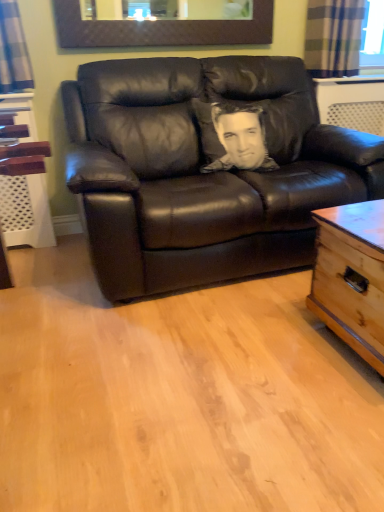
Question: Is plaid fabric curtain at upper right taller than light brown wooden trunk at right?

Choices:
 (A) yes
 (B) no

Answer: (B)

Question: Is plaid fabric curtain at upper right at the left side of light brown wooden trunk at right?

Choices:
 (A) no
 (B) yes

Answer: (A)

Question: From the image's perspective, is plaid fabric curtain at upper right beneath light brown wooden trunk at right?

Choices:
 (A) yes
 (B) no

Answer: (B)

Question: Is plaid fabric curtain at upper right oriented away from light brown wooden trunk at right?

Choices:
 (A) no
 (B) yes

Answer: (A)

Question: Is plaid fabric curtain at upper right at the right side of light brown wooden trunk at right?

Choices:
 (A) no
 (B) yes

Answer: (B)

Question: Do you think plaid fabric curtain at upper right is within matte brown picture frame at upper center, or outside of it?

Choices:
 (A) inside
 (B) outside

Answer: (B)

Question: Considering the positions of plaid fabric curtain at upper right and matte brown picture frame at upper center in the image, is plaid fabric curtain at upper right taller or shorter than matte brown picture frame at upper center?

Choices:
 (A) short
 (B) tall

Answer: (B)

Question: Visually, is plaid fabric curtain at upper right positioned to the left or to the right of matte brown picture frame at upper center?

Choices:
 (A) left
 (B) right

Answer: (B)

Question: From the image's perspective, is plaid fabric curtain at upper right positioned above or below matte brown picture frame at upper center?

Choices:
 (A) below
 (B) above

Answer: (B)

Question: From their relative heights in the image, would you say matte black leather couch at center is taller or shorter than sepia-toned pillow at center?

Choices:
 (A) short
 (B) tall

Answer: (B)

Question: Visually, is matte black leather couch at center positioned to the left or to the right of sepia-toned pillow at center?

Choices:
 (A) right
 (B) left

Answer: (A)

Question: Is matte black leather couch at center inside or outside of sepia-toned pillow at center?

Choices:
 (A) outside
 (B) inside

Answer: (A)

Question: From the image's perspective, is matte black leather couch at center positioned above or below sepia-toned pillow at center?

Choices:
 (A) above
 (B) below

Answer: (B)

Question: In the image, is matte brown picture frame at upper center positioned in front of or behind plaid fabric curtain at upper right?

Choices:
 (A) behind
 (B) front

Answer: (B)

Question: From a real-world perspective, is matte brown picture frame at upper center above or below plaid fabric curtain at upper right?

Choices:
 (A) below
 (B) above

Answer: (B)